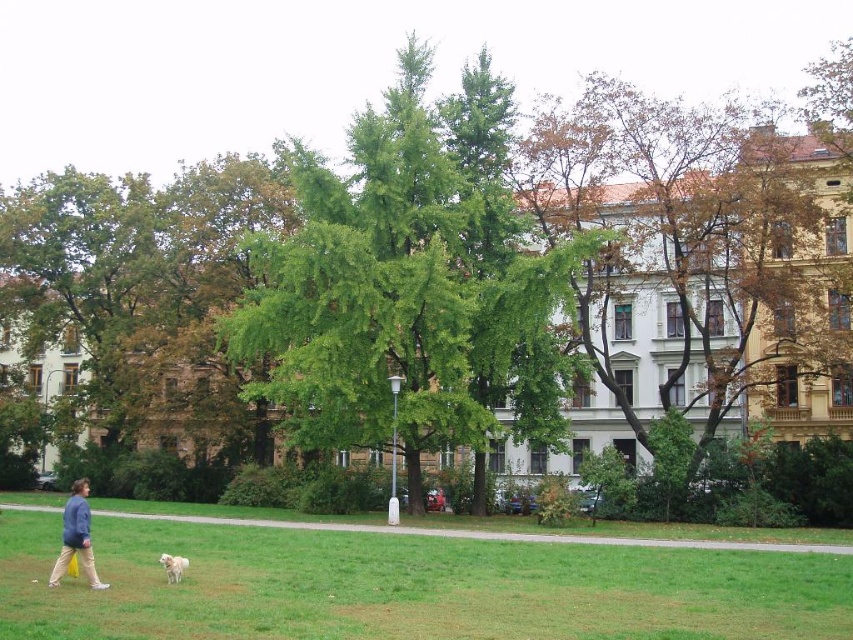
Consider the image. Does green leafy tree at center have a lesser height compared to blue denim jacket at lower left?

No.

This screenshot has width=853, height=640. In order to click on green leafy tree at center in this screenshot , I will do `click(412, 285)`.

Is green leafy tree at center bigger than brown textured tree at upper right?

Actually, green leafy tree at center might be smaller than brown textured tree at upper right.

Which is more to the left, green leafy tree at center or brown textured tree at upper right?

Positioned to the left is green leafy tree at center.

Between point (549, 442) and point (775, 147), which one is positioned in front?

Positioned in front is point (549, 442).

Locate an element on the screen. This screenshot has height=640, width=853. green leafy tree at center is located at coordinates click(412, 285).

Looking at this image, is green grass at lower left bigger than white fluffy dog at lower left?

Correct, green grass at lower left is larger in size than white fluffy dog at lower left.

Does green grass at lower left appear on the left side of white fluffy dog at lower left?

No, green grass at lower left is not to the left of white fluffy dog at lower left.

Between point (792, 611) and point (170, 570), which one is positioned in front?

Point (792, 611) is in front.

You are a GUI agent. You are given a task and a screenshot of the screen. Output one action in this format:
    pyautogui.click(x=<x>, y=<y>)
    Task: Click on the green grass at lower left
    This screenshot has width=853, height=640.
    Given the screenshot: What is the action you would take?
    pyautogui.click(x=409, y=588)